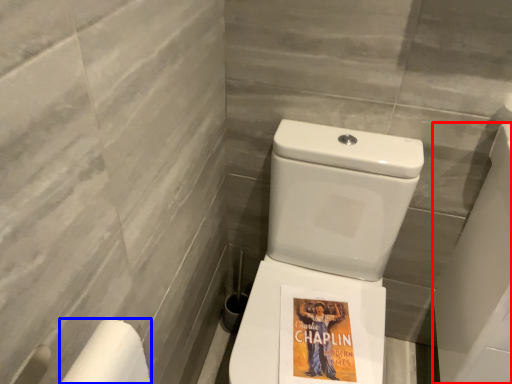
Question: Which point is further to the camera, porcelain (highlighted by a red box) or toilet paper (highlighted by a blue box)?

Choices:
 (A) porcelain
 (B) toilet paper

Answer: (A)